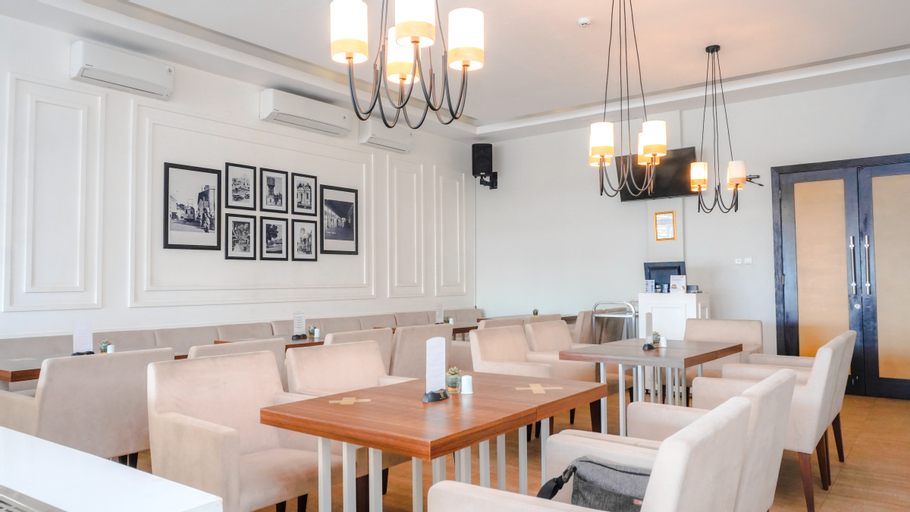
Where is `menus on tables`? Image resolution: width=910 pixels, height=512 pixels. menus on tables is located at coordinates (435, 365), (295, 320), (83, 337), (440, 311), (649, 321).